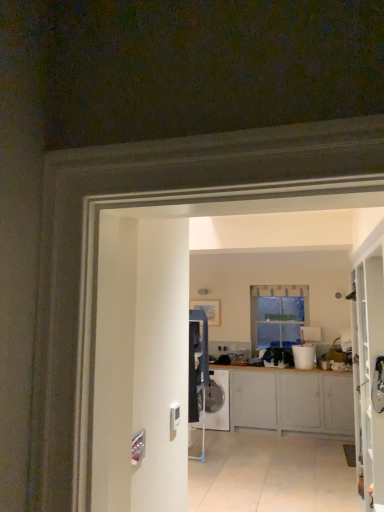
Question: In the image, is white glossy bucket at center on the left side or the right side of white glossy washing machine at center?

Choices:
 (A) left
 (B) right

Answer: (B)

Question: Is point (307, 357) closer or farther from the camera than point (220, 373)?

Choices:
 (A) farther
 (B) closer

Answer: (B)

Question: Which object is the closest to the white glossy bucket at center?

Choices:
 (A) matte gray cabinets at center
 (B) clear glass window at center
 (C) white glossy washing machine at center

Answer: (B)

Question: Which is farther from the matte gray cabinets at center?

Choices:
 (A) white glossy washing machine at center
 (B) clear glass window at center
 (C) white glossy bucket at center

Answer: (B)